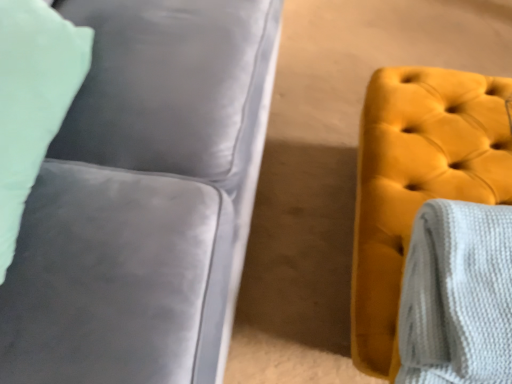
Question: From the image's perspective, is satin gray couch at left positioned above or below white textured blanket at right?

Choices:
 (A) below
 (B) above

Answer: (B)

Question: Considering the positions of point (253, 122) and point (425, 367), is point (253, 122) closer or farther from the camera than point (425, 367)?

Choices:
 (A) closer
 (B) farther

Answer: (B)

Question: Based on their relative distances, which object is farther from the velvet yellow ottoman at right?

Choices:
 (A) white textured blanket at right
 (B) satin gray couch at left

Answer: (B)

Question: Considering the real-world distances, which object is farthest from the white textured blanket at right?

Choices:
 (A) velvet yellow ottoman at right
 (B) satin gray couch at left

Answer: (B)